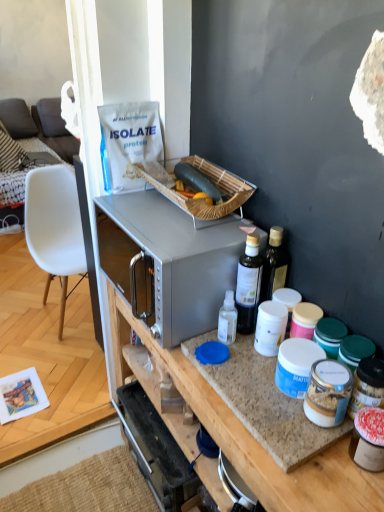
Question: Can you confirm if granite countertop at center is smaller than granite countertop at center?

Choices:
 (A) no
 (B) yes

Answer: (B)

Question: Is granite countertop at center aimed at granite countertop at center?

Choices:
 (A) no
 (B) yes

Answer: (A)

Question: Can you confirm if granite countertop at center is positioned to the left of granite countertop at center?

Choices:
 (A) yes
 (B) no

Answer: (B)

Question: Considering the relative sizes of granite countertop at center and granite countertop at center in the image provided, is granite countertop at center bigger than granite countertop at center?

Choices:
 (A) no
 (B) yes

Answer: (A)

Question: From a real-world perspective, is granite countertop at center over granite countertop at center?

Choices:
 (A) yes
 (B) no

Answer: (A)

Question: In terms of height, does bamboo picnic basket at upper center look taller or shorter compared to green matte zucchini at center?

Choices:
 (A) short
 (B) tall

Answer: (B)

Question: From the image's perspective, is bamboo picnic basket at upper center above or below green matte zucchini at center?

Choices:
 (A) below
 (B) above

Answer: (A)

Question: Considering the positions of point (148, 180) and point (193, 179), is point (148, 180) closer or farther from the camera than point (193, 179)?

Choices:
 (A) closer
 (B) farther

Answer: (B)

Question: In terms of width, does bamboo picnic basket at upper center look wider or thinner when compared to green matte zucchini at center?

Choices:
 (A) thin
 (B) wide

Answer: (B)

Question: Visually, is white plastic chair at left positioned to the left or to the right of satin silver microwave at center?

Choices:
 (A) left
 (B) right

Answer: (A)

Question: Is white plastic chair at left inside the boundaries of satin silver microwave at center, or outside?

Choices:
 (A) outside
 (B) inside

Answer: (A)

Question: Looking at the image, does white plastic chair at left seem bigger or smaller compared to satin silver microwave at center?

Choices:
 (A) small
 (B) big

Answer: (B)

Question: From the image's perspective, is white plastic chair at left positioned above or below satin silver microwave at center?

Choices:
 (A) above
 (B) below

Answer: (A)

Question: Considering their positions, is white plastic chair at left located in front of or behind bamboo picnic basket at upper center?

Choices:
 (A) front
 (B) behind

Answer: (B)

Question: Is white plastic chair at left wider or thinner than bamboo picnic basket at upper center?

Choices:
 (A) thin
 (B) wide

Answer: (B)